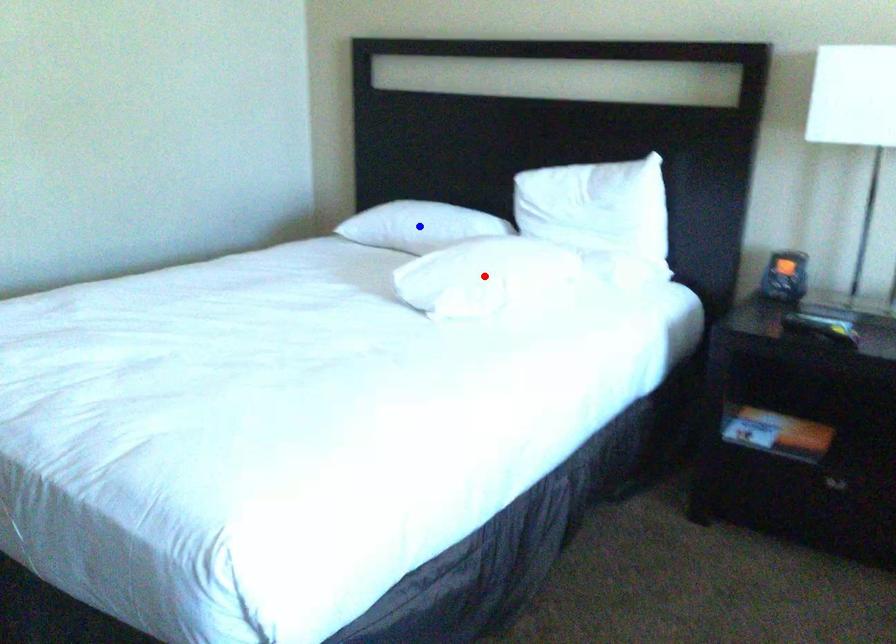
Question: In the image, two points are highlighted. Which point is nearer to the camera? Reply with the corresponding letter.

Choices:
 (A) blue point
 (B) red point

Answer: (B)